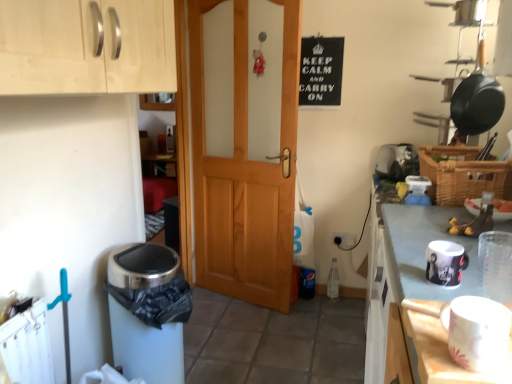
Question: Is matte black mug at right, the first appliance positioned from the left, oriented towards black matte sign at upper center?

Choices:
 (A) yes
 (B) no

Answer: (B)

Question: Does matte black mug at right, marked as the 1th appliance in a bottom-to-top arrangement, come behind black matte sign at upper center?

Choices:
 (A) no
 (B) yes

Answer: (A)

Question: Considering the relative sizes of matte black mug at right, which ranks as the 2th appliance in back-to-front order, and black matte sign at upper center in the image provided, is matte black mug at right, which ranks as the 2th appliance in back-to-front order, shorter than black matte sign at upper center?

Choices:
 (A) yes
 (B) no

Answer: (A)

Question: Is matte black mug at right, which is counted as the second appliance, starting from the right, oriented away from black matte sign at upper center?

Choices:
 (A) yes
 (B) no

Answer: (A)

Question: From the image's perspective, is matte black mug at right, arranged as the 2th appliance when viewed from the top, located beneath black matte sign at upper center?

Choices:
 (A) no
 (B) yes

Answer: (B)

Question: In terms of height, does white matte table at lower right look taller or shorter compared to white glossy mug at upper right?

Choices:
 (A) short
 (B) tall

Answer: (A)

Question: From the image's perspective, is white matte table at lower right above or below white glossy mug at upper right?

Choices:
 (A) below
 (B) above

Answer: (B)

Question: From a real-world perspective, relative to white glossy mug at upper right, is white matte table at lower right vertically above or below?

Choices:
 (A) below
 (B) above

Answer: (B)

Question: Is white matte table at lower right to the left or to the right of white glossy mug at upper right in the image?

Choices:
 (A) left
 (B) right

Answer: (A)

Question: From the image's perspective, relative to light wood cabinet at upper left, is white glossy mug at upper right above or below?

Choices:
 (A) below
 (B) above

Answer: (A)

Question: Which is correct: white glossy mug at upper right is inside light wood cabinet at upper left, or outside of it?

Choices:
 (A) outside
 (B) inside

Answer: (A)

Question: From a real-world perspective, is white glossy mug at upper right above or below light wood cabinet at upper left?

Choices:
 (A) above
 (B) below

Answer: (B)

Question: In the image, is white glossy mug at upper right positioned in front of or behind light wood cabinet at upper left?

Choices:
 (A) behind
 (B) front

Answer: (A)

Question: From a real-world perspective, relative to wooden door at center, is light wood cabinet at upper left vertically above or below?

Choices:
 (A) below
 (B) above

Answer: (B)

Question: Considering the positions of point (51, 23) and point (195, 215), is point (51, 23) closer or farther from the camera than point (195, 215)?

Choices:
 (A) farther
 (B) closer

Answer: (B)